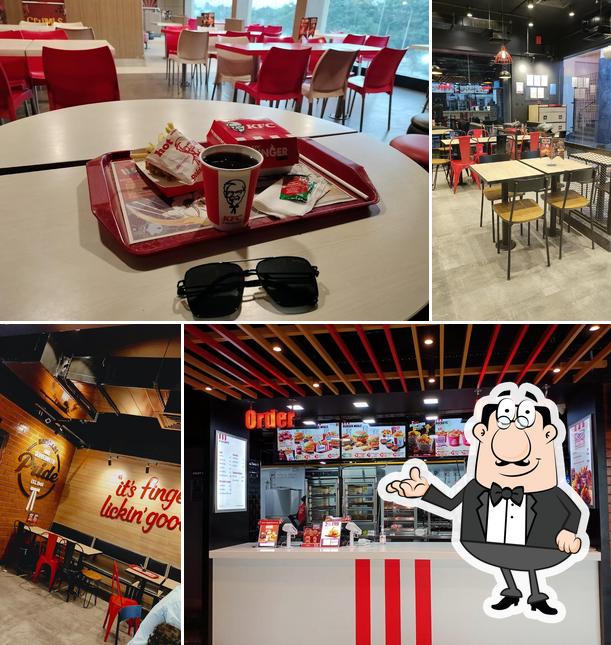
You are a GUI agent. You are given a task and a screenshot of the screen. Output one action in this format:
    pyautogui.click(x=<x>, y=<y>)
    Task: Click on the cash register
    
    Given the screenshot: What is the action you would take?
    pyautogui.click(x=293, y=531), pyautogui.click(x=346, y=528)